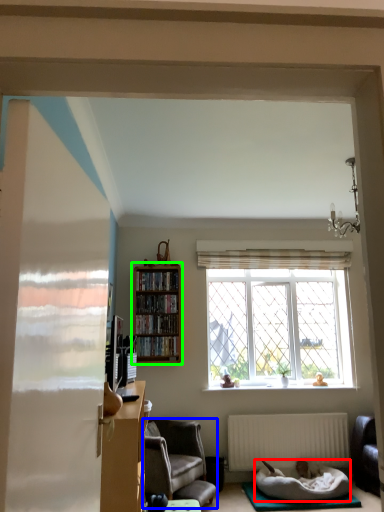
Question: Which is farther away from bedding (highlighted by a red box)? chair (highlighted by a blue box) or bookcase (highlighted by a green box)?

Choices:
 (A) chair
 (B) bookcase

Answer: (B)